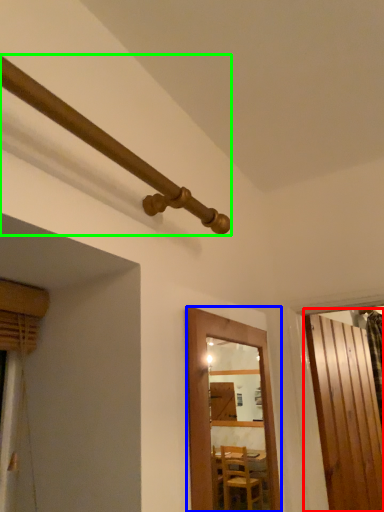
Question: Which object is the closest to the door (highlighted by a red box)? Choose among these: door (highlighted by a blue box) or pipe (highlighted by a green box).

Choices:
 (A) door
 (B) pipe

Answer: (A)